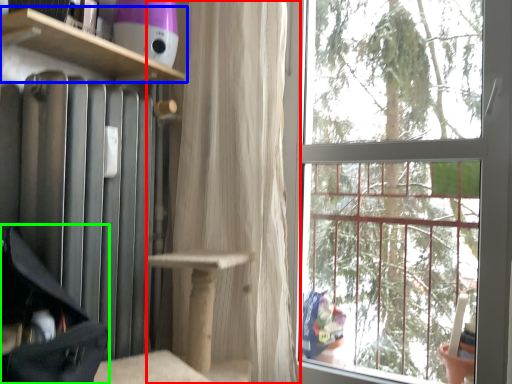
Question: Which object is positioned closest to curtain (highlighted by a red box)? Select from shelf (highlighted by a blue box) and luggage (highlighted by a green box).

Choices:
 (A) shelf
 (B) luggage

Answer: (A)